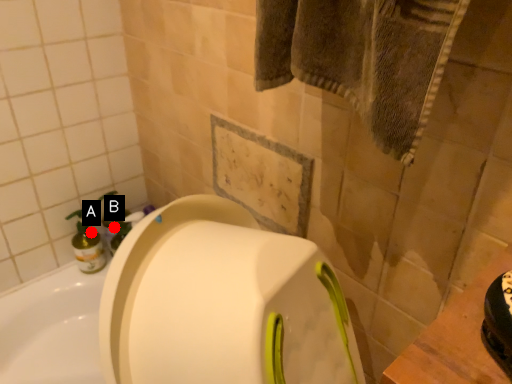
Question: Two points are circled on the image, labeled by A and B beside each circle. Which point is farther to the camera?

Choices:
 (A) A is further
 (B) B is further

Answer: (B)